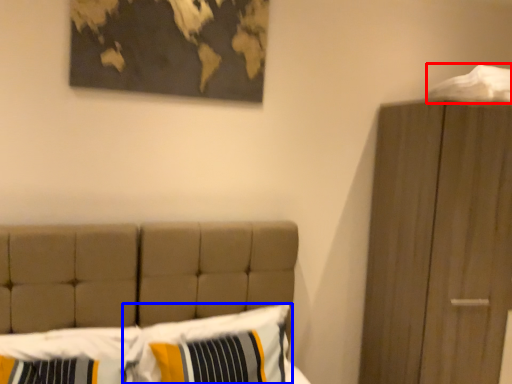
Question: Which of the following is the closest to the observer, sheet (highlighted by a red box) or pillow (highlighted by a blue box)?

Choices:
 (A) sheet
 (B) pillow

Answer: (B)